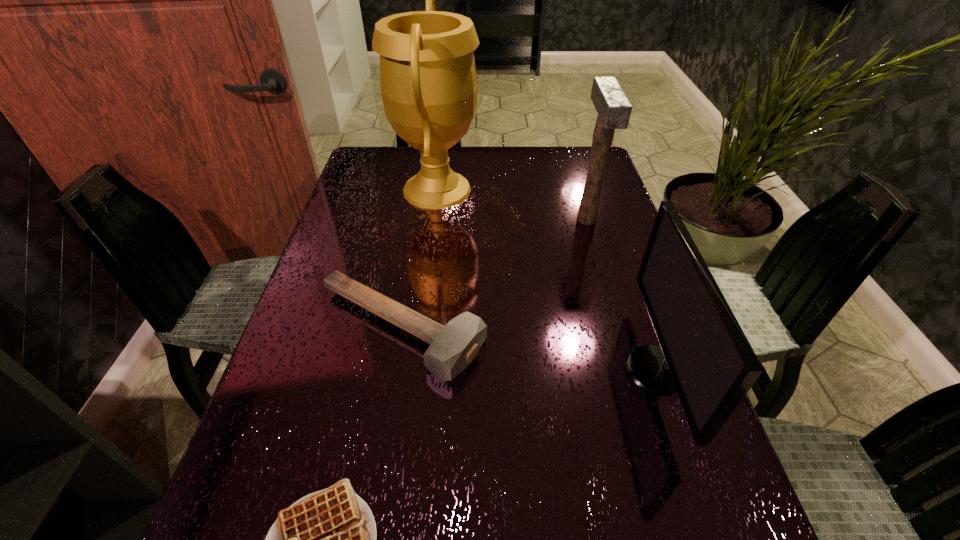
Image resolution: width=960 pixels, height=540 pixels. Find the location of `vacant space positioned 0.270m on the front-facing side of the third shortest object`. vacant space positioned 0.270m on the front-facing side of the third shortest object is located at coordinates (486, 369).

Where is `free space located on the right of the left mallet`? Image resolution: width=960 pixels, height=540 pixels. free space located on the right of the left mallet is located at coordinates (591, 329).

This screenshot has width=960, height=540. In order to click on object present at the far edge in this screenshot , I will do click(x=428, y=81).

Locate an element on the screen. This screenshot has width=960, height=540. trophy that is at the left edge is located at coordinates (428, 81).

You are a GUI agent. You are given a task and a screenshot of the screen. Output one action in this format:
    pyautogui.click(x=<x>, y=<y>)
    Task: Click on the mallet that is at the left edge
    The width and height of the screenshot is (960, 540).
    Given the screenshot: What is the action you would take?
    pyautogui.click(x=452, y=347)

At what (x,y) coordinates should I click in order to perform the action: click on mallet at the right edge. Please return your answer as a coordinate pair (x, y). Looking at the image, I should click on (614, 110).

Locate an element on the screen. This screenshot has height=540, width=960. computer monitor that is at the right edge is located at coordinates (704, 355).

I want to click on object at the far left corner, so click(428, 81).

Where is `vacant position at the far edge of the desktop`? The height and width of the screenshot is (540, 960). vacant position at the far edge of the desktop is located at coordinates (504, 157).

Where is `vacant area at the left edge of the desktop`? vacant area at the left edge of the desktop is located at coordinates (315, 467).